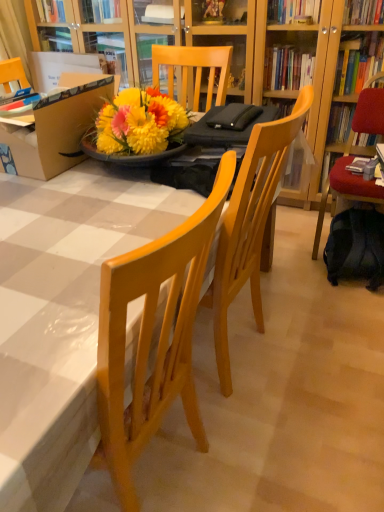
Question: From a real-world perspective, is matte cardboard box at upper left positioned above or below wooden table at center?

Choices:
 (A) below
 (B) above

Answer: (B)

Question: From their relative heights in the image, would you say matte cardboard box at upper left is taller or shorter than wooden table at center?

Choices:
 (A) short
 (B) tall

Answer: (A)

Question: Estimate the real-world distances between objects in this image. Which object is closer to the hardcover book at right?

Choices:
 (A) velvet red chair at right
 (B) dark blue fabric backpack at lower right
 (C) wooden table at center
 (D) matte cardboard box at upper left

Answer: (A)

Question: Estimate the real-world distances between objects in this image. Which object is farther from the hardcover book at right?

Choices:
 (A) matte cardboard box at upper left
 (B) wooden table at center
 (C) velvet red chair at right
 (D) dark blue fabric backpack at lower right

Answer: (B)